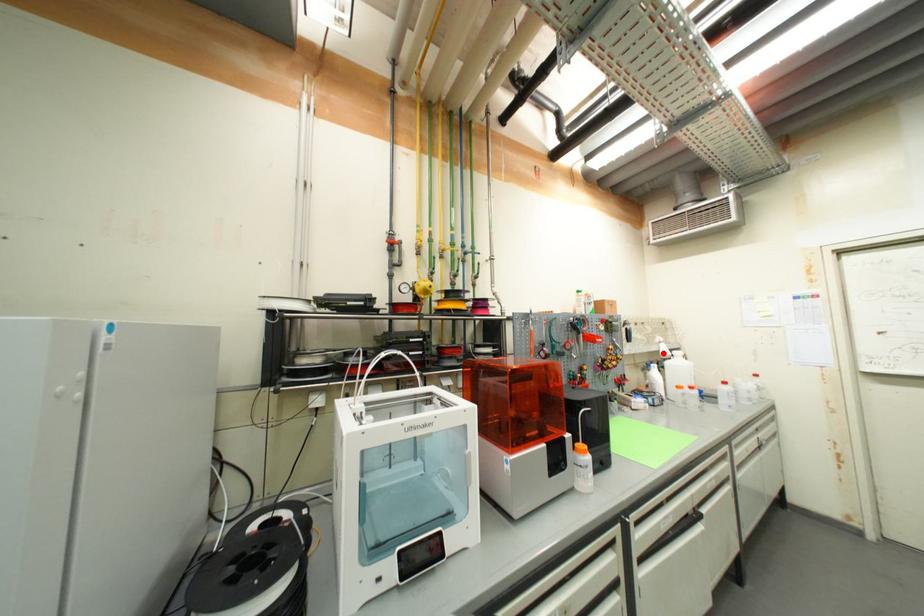
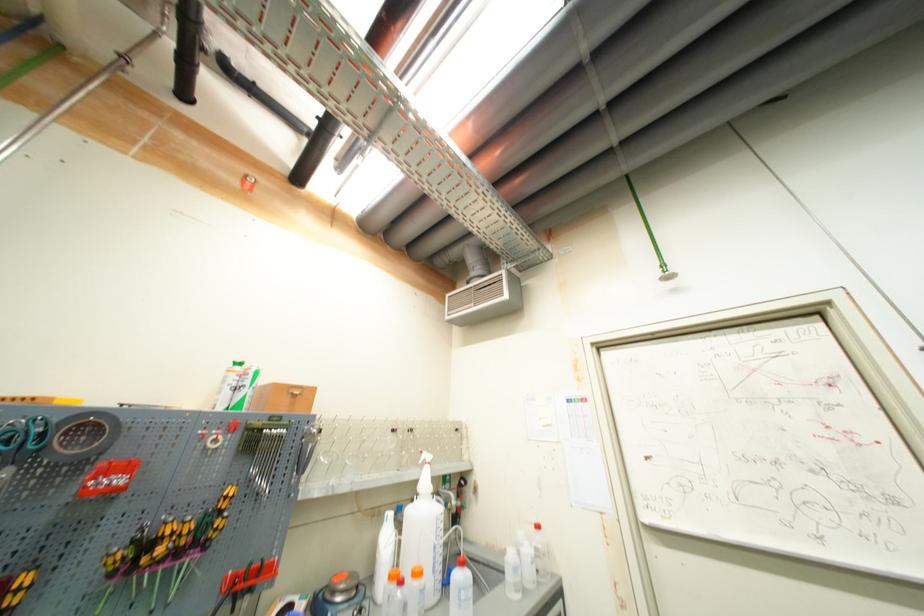
Where in the second image is the point corresponding to the highlighted location from the first image?

(421, 484)